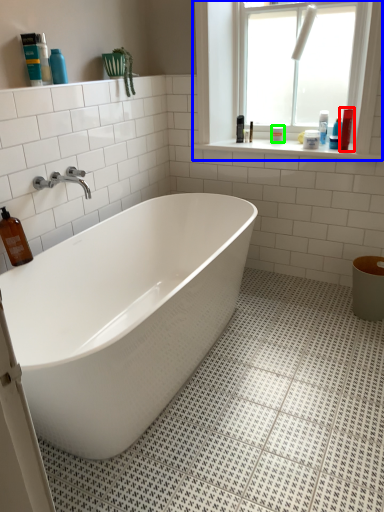
Question: Which object is the farthest from cleaning product (highlighted by a red box)? Choose among these: window (highlighted by a blue box) or toiletry (highlighted by a green box).

Choices:
 (A) window
 (B) toiletry

Answer: (A)